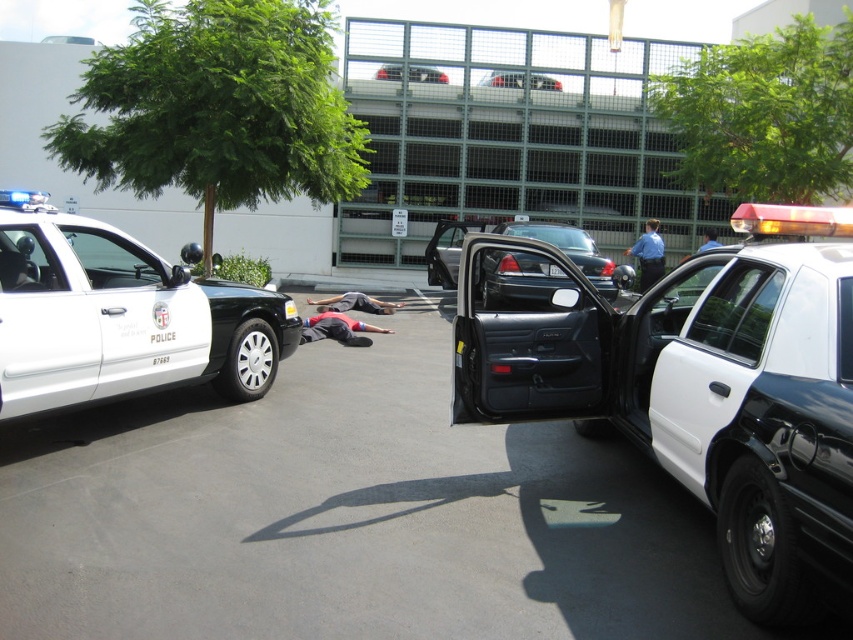
You are a security guard assessing the scene. You notice the white glossy police car at center and the blue uniform at center. Which object is shorter in height?

The white glossy police car at center has a lesser height compared to the blue uniform at center, so the white glossy police car at center is shorter.

You are a security officer trying to assess the situation from a nearby building. You see the white glossy police car at left and the red fabric body at center. Which object appears bigger in your view?

The white glossy police car at left appears bigger in your view because it is larger in size than the red fabric body at center.

You are a security guard in the parking lot. You need to check the height of the gray fabric shirt at center and the metallic silver sedan at center. Which one is shorter?

The gray fabric shirt at center is not as tall as metallic silver sedan at center, so the gray fabric shirt at center is shorter.